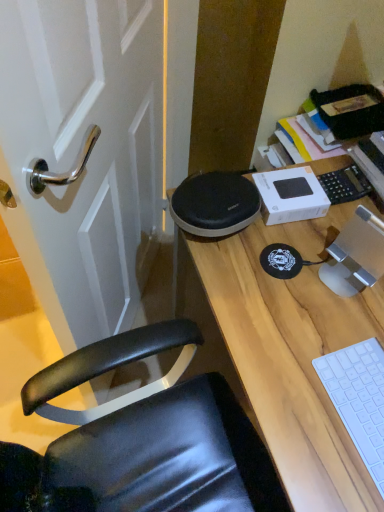
Where is `vacant space behind white plastic keyboard at lower right`? vacant space behind white plastic keyboard at lower right is located at coordinates (322, 316).